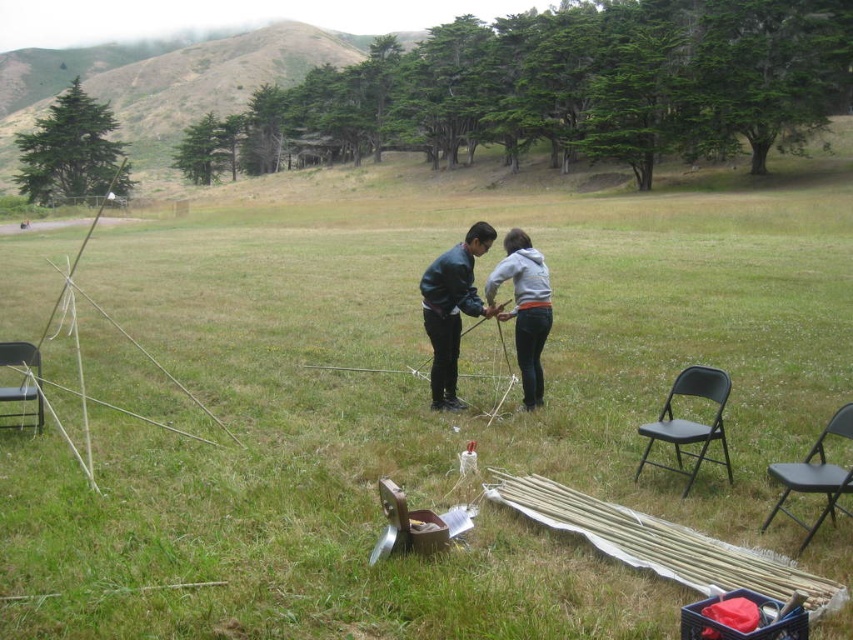
You need to choose between the black plastic chair at right and the black metal chair at left for a guest who prefers a wider seat. Which chair should they use?

The black metal chair at left has a greater width than the black plastic chair at right, so the guest should use the black metal chair at left.

You are a photographer trying to capture a closeup of both the matte black jacket at center and the gray fleece hoodie at center. Given that your camera can focus on objects within a 10 inch range, will you be able to get both items in focus at the same time?

The matte black jacket at center is 7.53 inches from the gray fleece hoodie at center, which is within the 10 inch focus range of the camera. Therefore, both items can be captured in focus simultaneously.